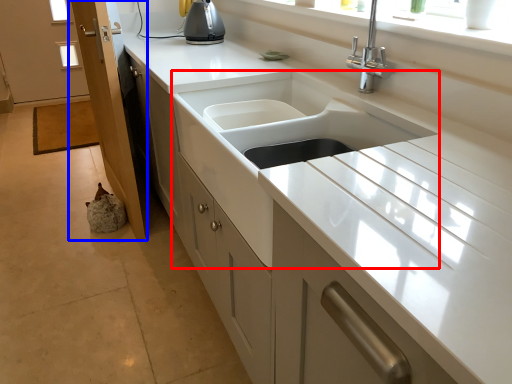
Question: Which of the following is the closest to the observer, sink (highlighted by a red box) or screen door (highlighted by a blue box)?

Choices:
 (A) sink
 (B) screen door

Answer: (A)